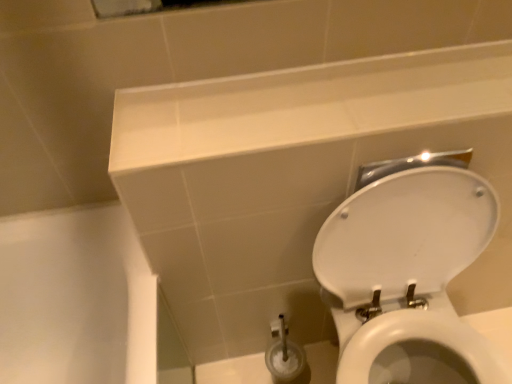
Question: Is white glossy toilet at lower right wider than white glossy ledge at upper center?

Choices:
 (A) yes
 (B) no

Answer: (A)

Question: Does white glossy toilet at lower right come in front of white glossy ledge at upper center?

Choices:
 (A) yes
 (B) no

Answer: (A)

Question: Is white glossy ledge at upper center inside white glossy toilet at lower right?

Choices:
 (A) no
 (B) yes

Answer: (A)

Question: Could you tell me if white glossy toilet at lower right is facing white glossy ledge at upper center?

Choices:
 (A) no
 (B) yes

Answer: (A)

Question: Does white glossy toilet at lower right have a smaller size compared to white glossy ledge at upper center?

Choices:
 (A) yes
 (B) no

Answer: (B)

Question: Is white glossy toilet at lower right placed right next to white glossy ledge at upper center?

Choices:
 (A) no
 (B) yes

Answer: (A)

Question: Is white glossy ledge at upper center taller than white glossy toilet at lower right?

Choices:
 (A) yes
 (B) no

Answer: (B)

Question: From a real-world perspective, is white glossy ledge at upper center below white glossy toilet at lower right?

Choices:
 (A) no
 (B) yes

Answer: (A)

Question: From the image's perspective, is white glossy ledge at upper center below white glossy toilet at lower right?

Choices:
 (A) no
 (B) yes

Answer: (A)

Question: Does white glossy ledge at upper center lie in front of white glossy toilet at lower right?

Choices:
 (A) yes
 (B) no

Answer: (B)

Question: From the image's perspective, is white glossy ledge at upper center above white glossy toilet at lower right?

Choices:
 (A) yes
 (B) no

Answer: (A)

Question: Is white glossy ledge at upper center wider than white glossy toilet at lower right?

Choices:
 (A) no
 (B) yes

Answer: (A)

Question: Is white glossy ledge at upper center wider or thinner than white glossy toilet at lower right?

Choices:
 (A) thin
 (B) wide

Answer: (A)